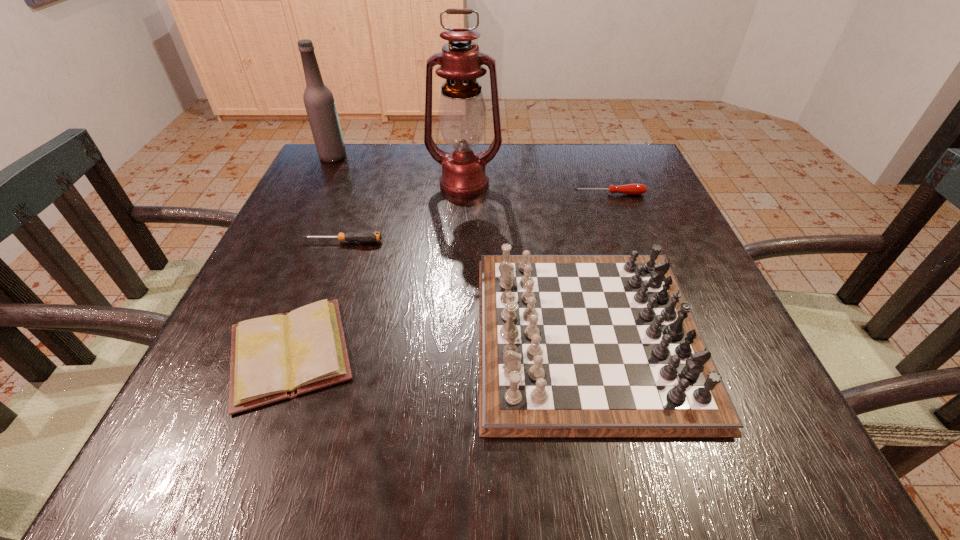
I want to click on free space between the farthest object and the oil lamp, so click(398, 170).

Find the location of a particular element. Image resolution: width=960 pixels, height=540 pixels. vacant point located between the diary and the left screwdriver is located at coordinates (317, 298).

The width and height of the screenshot is (960, 540). In order to click on free space between the third tallest object and the left screwdriver in this screenshot , I will do `click(466, 288)`.

The width and height of the screenshot is (960, 540). Find the location of `empty location between the farthest object and the third tallest object`. empty location between the farthest object and the third tallest object is located at coordinates (460, 245).

Locate an element on the screen. The height and width of the screenshot is (540, 960). vacant space that is in between the farther screwdriver and the third nearest object is located at coordinates (476, 218).

At what (x,y) coordinates should I click in order to perform the action: click on blank region between the fourth farthest object and the oil lamp. Please return your answer as a coordinate pair (x, y). Image resolution: width=960 pixels, height=540 pixels. Looking at the image, I should click on (403, 213).

Select which object appears as the third closest to the farther screwdriver. Please provide its 2D coordinates. Your answer should be formatted as a tuple, i.e. [(x, y)], where the tuple contains the x and y coordinates of a point satisfying the conditions above.

[(363, 236)]

Locate which object ranks fourth in proximity to the tallest object. Please provide its 2D coordinates. Your answer should be formatted as a tuple, i.e. [(x, y)], where the tuple contains the x and y coordinates of a point satisfying the conditions above.

[(319, 102)]

I want to click on vacant region that satisfies the following two spatial constraints: 1. on the side of the farther screwdriver with the label; 2. on the left side of the beer bottle, so click(315, 194).

At what (x,y) coordinates should I click in order to perform the action: click on free spot that satisfies the following two spatial constraints: 1. on the side of the farther screwdriver with the label; 2. on the right side of the fifth shortest object. Please return your answer as a coordinate pair (x, y). The width and height of the screenshot is (960, 540). Looking at the image, I should click on (315, 194).